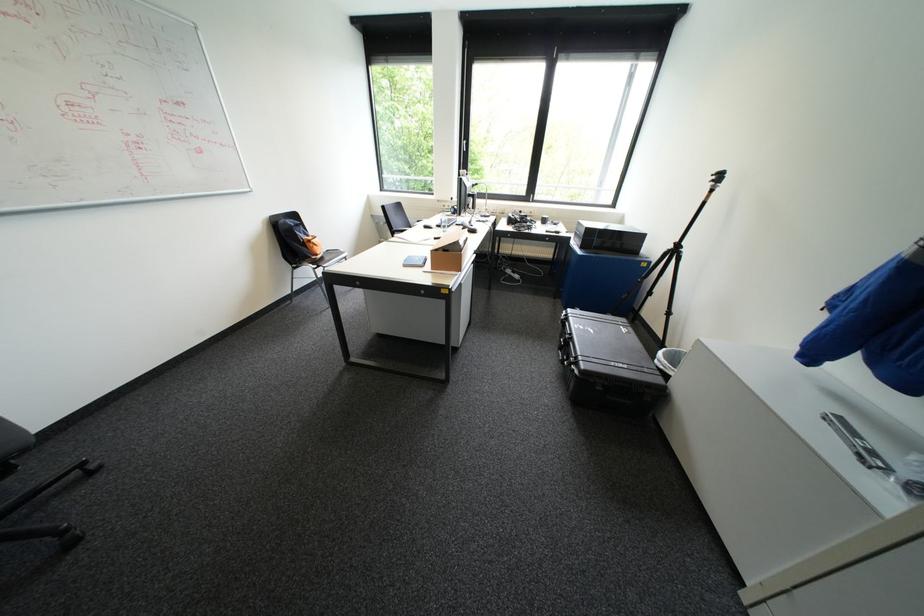
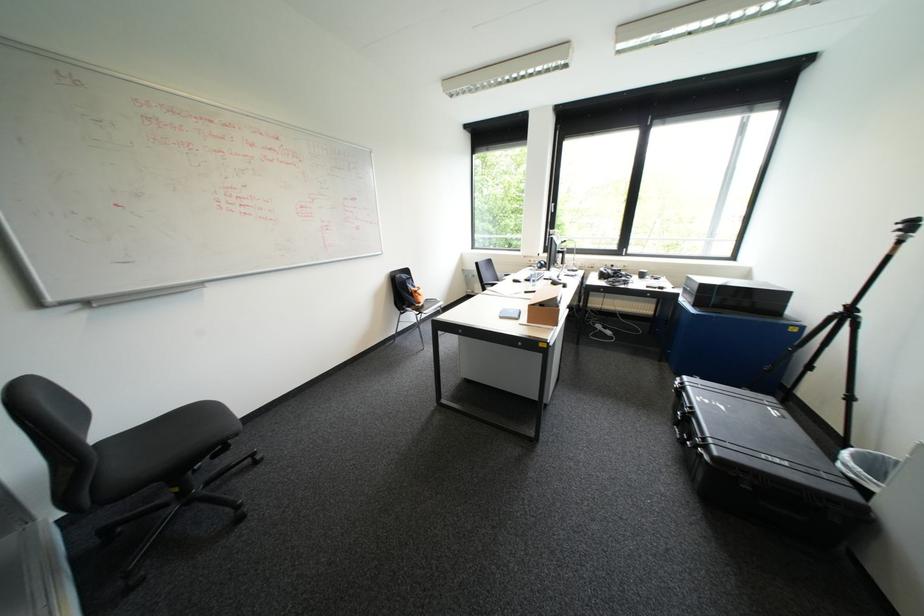
Find the pixel in the second image that matches (567,350) in the first image.

(684, 426)